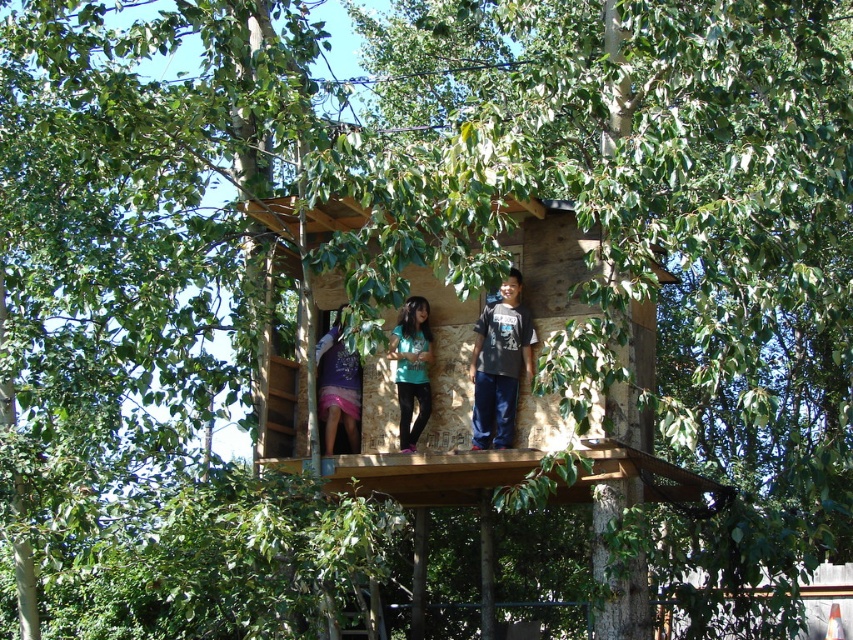
Question: In this image, where is dark gray t-shirt at center located relative to teal matte shirt at center?

Choices:
 (A) left
 (B) right

Answer: (B)

Question: Which is farther from the matte purple dress at center?

Choices:
 (A) dark gray t-shirt at center
 (B) teal matte shirt at center

Answer: (A)

Question: Is dark gray t-shirt at center smaller than matte purple dress at center?

Choices:
 (A) no
 (B) yes

Answer: (B)

Question: Where is dark gray t-shirt at center located in relation to matte purple dress at center in the image?

Choices:
 (A) right
 (B) left

Answer: (A)

Question: Among these objects, which one is nearest to the camera?

Choices:
 (A) dark gray t-shirt at center
 (B) teal matte shirt at center

Answer: (A)

Question: Which object is positioned farthest from the teal matte shirt at center?

Choices:
 (A) dark gray t-shirt at center
 (B) matte purple dress at center

Answer: (A)